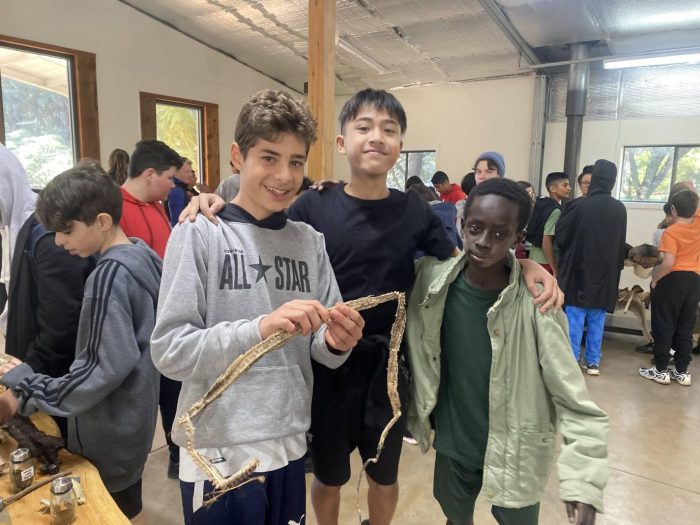
Locate an element on the screen. window is located at coordinates (50, 127).